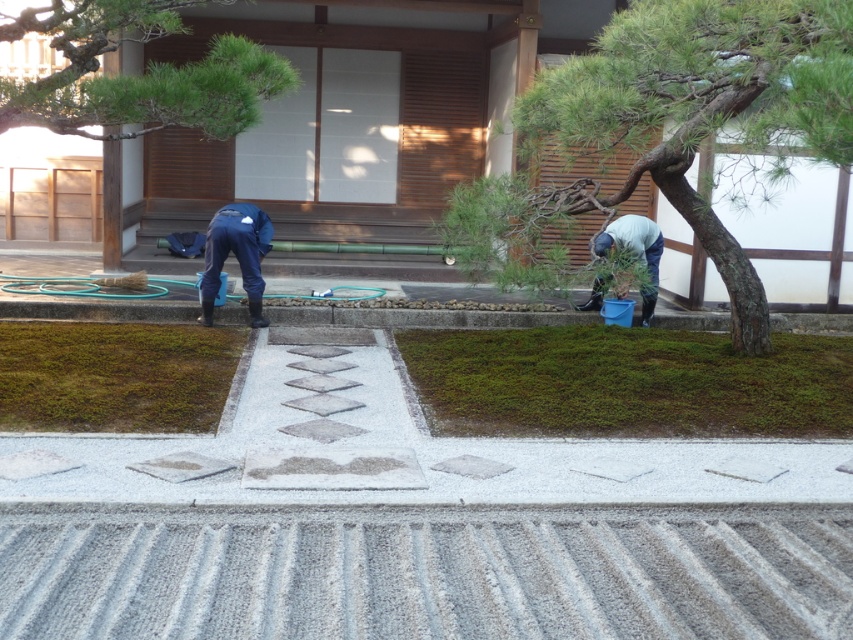
Where is `green textured tree at center`? green textured tree at center is located at coordinates (x=669, y=132).

Is point (590, 64) closer to camera compared to point (165, 385)?

Yes, it is.

Find the location of a particular element. green textured tree at center is located at coordinates (669, 132).

At what (x,y) coordinates should I click in order to perform the action: click on green textured tree at center. Please return your answer as a coordinate pair (x, y). Looking at the image, I should click on (669, 132).

Which is below, green textured pine tree at upper center or green mossy ground at lower left?

green mossy ground at lower left is below.

Does green textured pine tree at upper center have a greater height compared to green mossy ground at lower left?

Correct, green textured pine tree at upper center is much taller as green mossy ground at lower left.

From the picture: Who is more distant from viewer, (x=94, y=77) or (x=234, y=364)?

The point (x=234, y=364) is behind.

Where is `green textured pine tree at upper center`? green textured pine tree at upper center is located at coordinates (136, 76).

Describe the element at coordinates (136, 76) in the screenshot. The image size is (853, 640). I see `green textured pine tree at upper center` at that location.

Who is lower down, green textured pine tree at upper center or blue rubber boots at right?

blue rubber boots at right

You are a GUI agent. You are given a task and a screenshot of the screen. Output one action in this format:
    pyautogui.click(x=<x>, y=<y>)
    Task: Click on the green textured pine tree at upper center
    
    Given the screenshot: What is the action you would take?
    pyautogui.click(x=136, y=76)